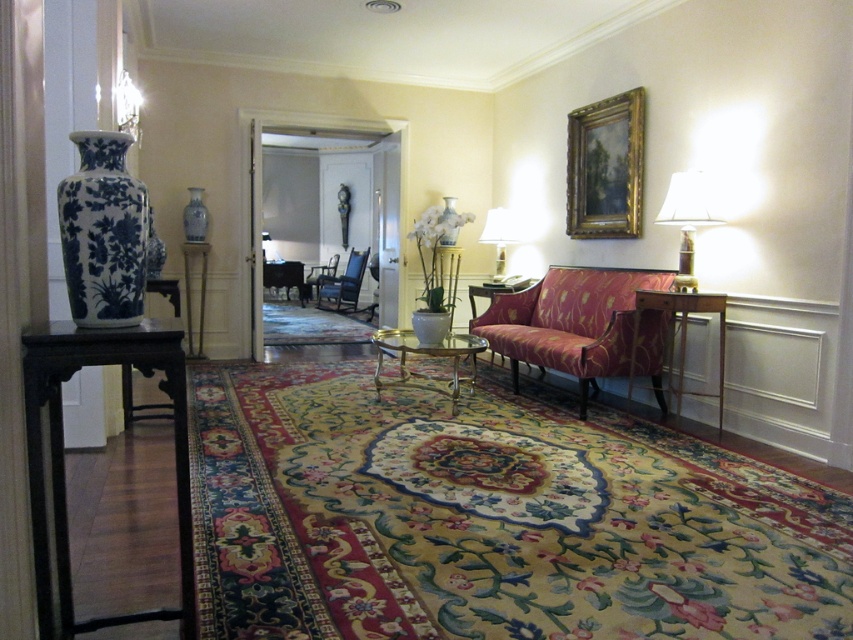
You are standing in the living room and want to place a 3.66 meter long sofa on the floor. The sofa must be placed in a straight line from your current position to the wooden side table at right. Is there enough space for the sofa?

The distance between you and the wooden side table at right is 3.81 meters. Since the sofa is 3.66 meters long, it will fit within the available space as 3.66 meters is less than 3.81 meters.

You are planning to place a new rectangular coffee table in the living room. The coffee table is 1.2 meters wide. You want to position it between the blue fabric armchair at center and the matte glass lamp at upper right. Based on the space between them, will the coffee table fit comfortably without being too cramped?

The blue fabric armchair at center is wider than the matte glass lamp at upper right. However, the exact distance between them isn

You are sitting on the velvet floral sofa at right and want to place a book on the wooden side table at right. Can you reach it without getting up?

The wooden side table at right is to the right of the velvet floral sofa at right, so if the sofa is positioned such that the side table is within arm reach from the right side, you might be able to reach it without getting up. However, the exact distance isn